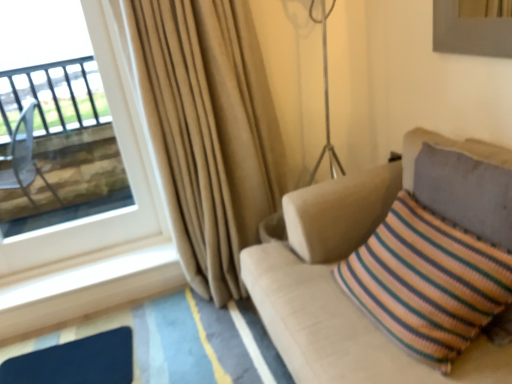
Question: Is beige fabric couch at right completely or partially outside of beige fabric curtain at left?

Choices:
 (A) no
 (B) yes

Answer: (B)

Question: From a real-world perspective, is beige fabric couch at right over beige fabric curtain at left?

Choices:
 (A) yes
 (B) no

Answer: (B)

Question: Would you say beige fabric couch at right is a long distance from beige fabric curtain at left?

Choices:
 (A) no
 (B) yes

Answer: (A)

Question: Is the depth of beige fabric couch at right greater than that of beige fabric curtain at left?

Choices:
 (A) no
 (B) yes

Answer: (A)

Question: Is beige fabric couch at right facing towards beige fabric curtain at left?

Choices:
 (A) no
 (B) yes

Answer: (A)

Question: From their relative heights in the image, would you say beige fabric curtain at left is taller or shorter than matte blue mat at lower left?

Choices:
 (A) tall
 (B) short

Answer: (A)

Question: Based on their positions, is beige fabric curtain at left located to the left or right of matte blue mat at lower left?

Choices:
 (A) right
 (B) left

Answer: (A)

Question: Which is correct: beige fabric curtain at left is inside matte blue mat at lower left, or outside of it?

Choices:
 (A) inside
 (B) outside

Answer: (B)

Question: In the image, is beige fabric curtain at left positioned in front of or behind matte blue mat at lower left?

Choices:
 (A) behind
 (B) front

Answer: (B)

Question: Is point (162, 99) positioned closer to the camera than point (131, 165)?

Choices:
 (A) closer
 (B) farther

Answer: (A)

Question: Considering the positions of beige fabric curtain at left and transparent glass window at upper left in the image, is beige fabric curtain at left wider or thinner than transparent glass window at upper left?

Choices:
 (A) thin
 (B) wide

Answer: (B)

Question: Considering their positions, is beige fabric curtain at left located in front of or behind transparent glass window at upper left?

Choices:
 (A) behind
 (B) front

Answer: (B)

Question: From the image's perspective, is beige fabric curtain at left above or below transparent glass window at upper left?

Choices:
 (A) below
 (B) above

Answer: (A)

Question: From the image's perspective, is beige fabric couch at right located above or below transparent glass window at upper left?

Choices:
 (A) below
 (B) above

Answer: (A)

Question: In terms of width, does beige fabric couch at right look wider or thinner when compared to transparent glass window at upper left?

Choices:
 (A) wide
 (B) thin

Answer: (A)